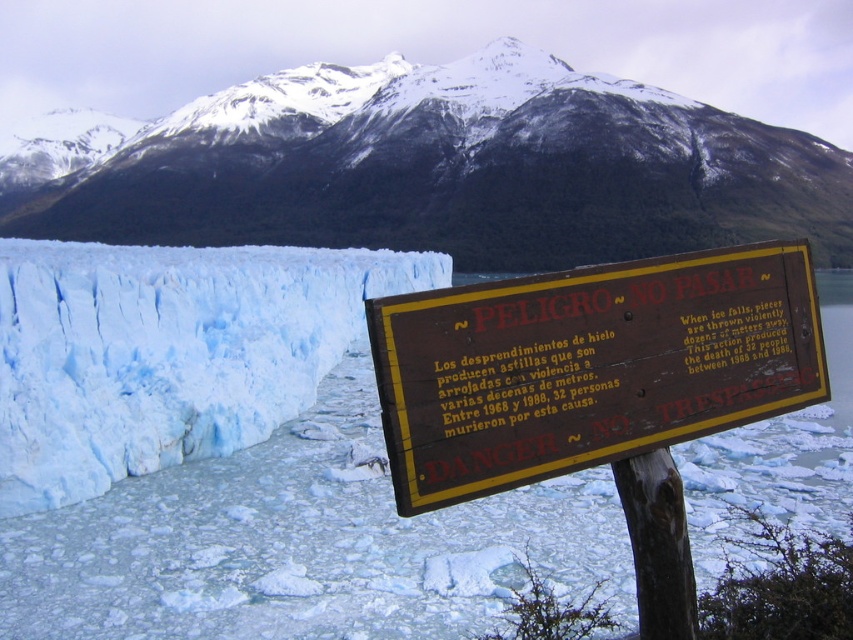
Can you confirm if brown wooden sign at center is positioned to the left of blue ice glacier at left?

Incorrect, brown wooden sign at center is not on the left side of blue ice glacier at left.

Is brown wooden sign at center below blue ice glacier at left?

Indeed, brown wooden sign at center is positioned under blue ice glacier at left.

Image resolution: width=853 pixels, height=640 pixels. What are the coordinates of `brown wooden sign at center` in the screenshot? It's located at (589, 365).

Between snowy rock mountain at upper center and blue ice glacier at left, which one appears on the left side from the viewer's perspective?

Positioned to the left is snowy rock mountain at upper center.

Measure the distance from snowy rock mountain at upper center to blue ice glacier at left.

snowy rock mountain at upper center is 105.08 meters from blue ice glacier at left.

You are a GUI agent. You are given a task and a screenshot of the screen. Output one action in this format:
    pyautogui.click(x=<x>, y=<y>)
    Task: Click on the snowy rock mountain at upper center
    The height and width of the screenshot is (640, 853).
    Given the screenshot: What is the action you would take?
    pyautogui.click(x=456, y=168)

Is point (434, 108) positioned in front of point (682, 406)?

No, (434, 108) is further to viewer.

Based on the photo, does snowy rock mountain at upper center have a lesser height compared to brown wooden sign at center?

Incorrect, snowy rock mountain at upper center's height does not fall short of brown wooden sign at center's.

Does point (637, 128) come closer to viewer compared to point (573, 445)?

No, it is not.

This screenshot has height=640, width=853. In order to click on snowy rock mountain at upper center in this screenshot , I will do `click(456, 168)`.